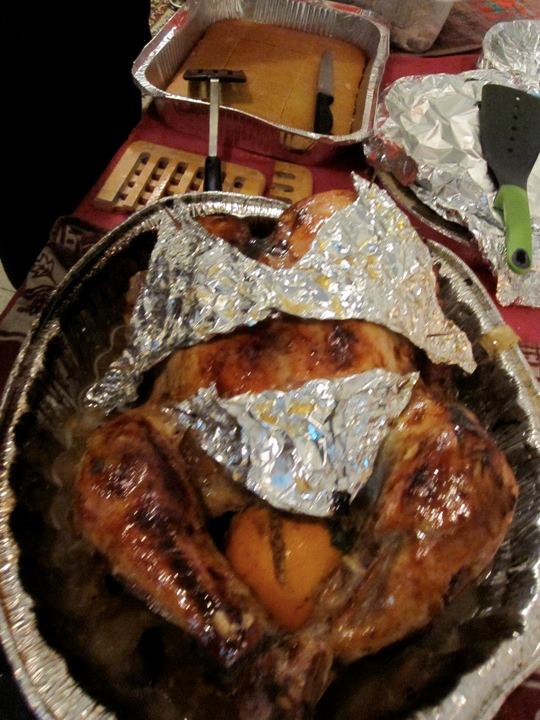
This screenshot has height=720, width=540. Find the location of `knife handle`. knife handle is located at coordinates (326, 114).